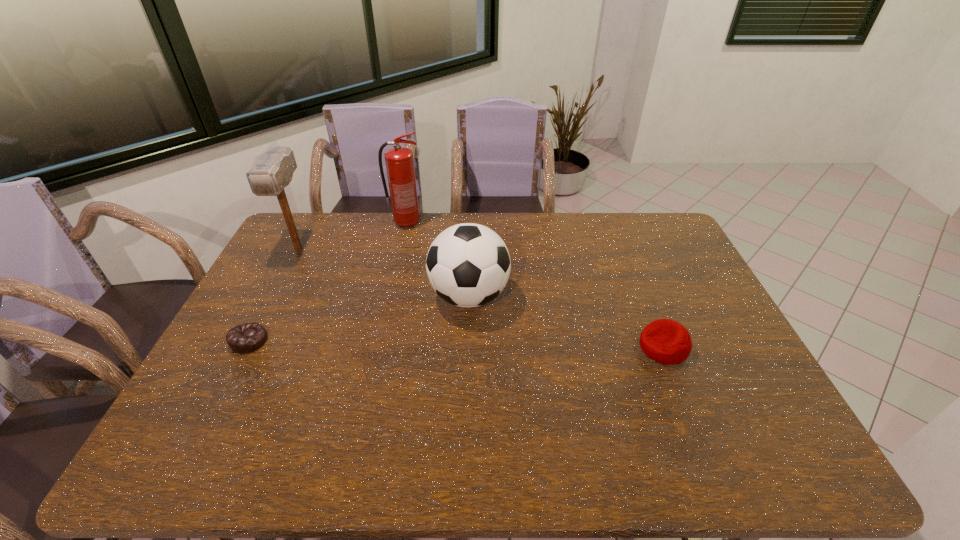
What are the coordinates of `vacant position in the image that satisfies the following two spatial constraints: 1. on the handle side the third shortest object; 2. on the right side of the fire extinguisher` in the screenshot? It's located at (390, 296).